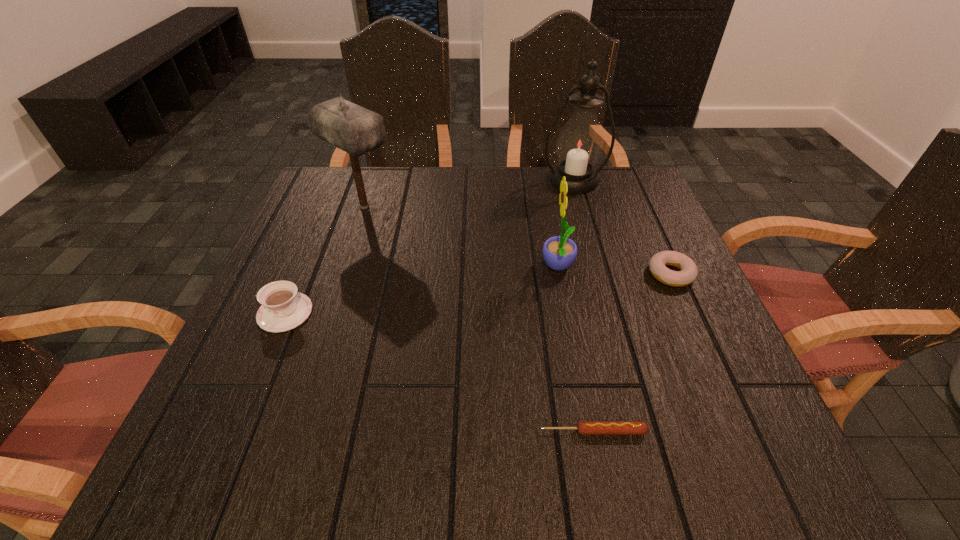
You are a GUI agent. You are given a task and a screenshot of the screen. Output one action in this format:
    pyautogui.click(x=<x>, y=<y>)
    Task: Click on the vacant space at the far right corner of the desktop
    This screenshot has height=540, width=960.
    Given the screenshot: What is the action you would take?
    pyautogui.click(x=645, y=195)

Where is `free spot between the rightmost object and the fourth tallest object`? Image resolution: width=960 pixels, height=540 pixels. free spot between the rightmost object and the fourth tallest object is located at coordinates (478, 293).

This screenshot has height=540, width=960. In order to click on empty location between the sausage and the tallest object in this screenshot , I will do `click(584, 306)`.

Identify the location of vacant space in between the sunflower and the fourth tallest object. (421, 290).

Find the location of `vacant area that lies between the doughnut and the oil lamp`. vacant area that lies between the doughnut and the oil lamp is located at coordinates (622, 227).

This screenshot has width=960, height=540. What are the coordinates of `free spot between the rightmost object and the second nearest object` in the screenshot? It's located at (478, 293).

Locate an element on the screen. This screenshot has height=540, width=960. free space that is in between the teacup and the sausage is located at coordinates (439, 372).

This screenshot has width=960, height=540. I want to click on free area in between the oil lamp and the third shortest object, so click(429, 246).

Where is `free spot between the shortest object and the tallest object`? This screenshot has height=540, width=960. free spot between the shortest object and the tallest object is located at coordinates (584, 306).

Where is `vacant point located between the sausage and the fourth shortest object`? Image resolution: width=960 pixels, height=540 pixels. vacant point located between the sausage and the fourth shortest object is located at coordinates (576, 349).